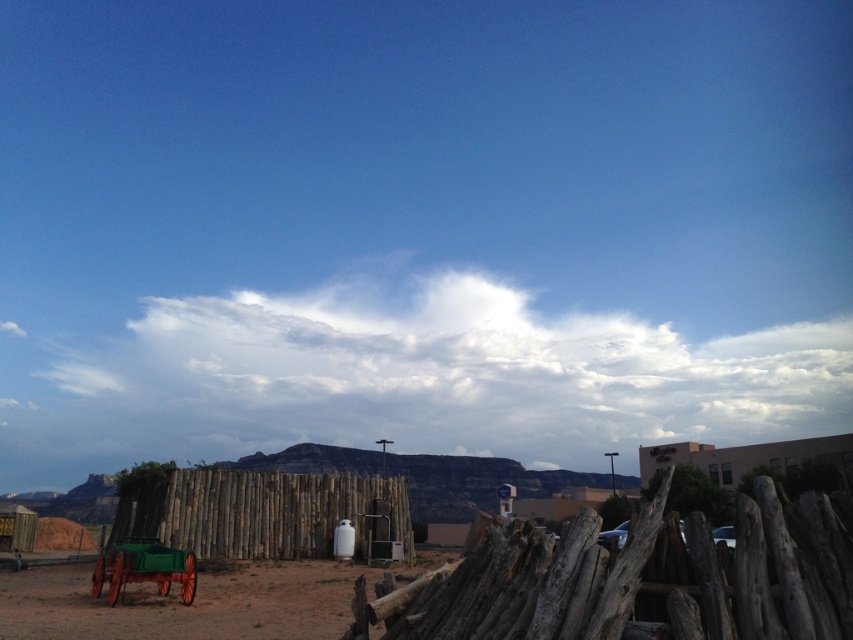
You are a gardener planning to plant a row of sunflowers between the brown dirt field at lower left and the wooden fence at center. Considering their heights, which object will the sunflowers likely grow taller than?

The brown dirt field at lower left is taller than the wooden fence at center, so the sunflowers planted between them would likely grow taller than the wooden fence at center.

You are an astronomer observing the sky and the ground. You notice the white fluffy cloud at upper center and the wooden fence at center. Which object is higher in the sky?

The white fluffy cloud at upper center is much taller than the wooden fence at center, so it is higher in the sky.

You are standing at the edge of the brown dirt field at lower left and want to walk towards the wooden fence at center. Which direction should you move to reach it?

The brown dirt field at lower left is located below the wooden fence at center, so you should move upward to reach the wooden fence at center.